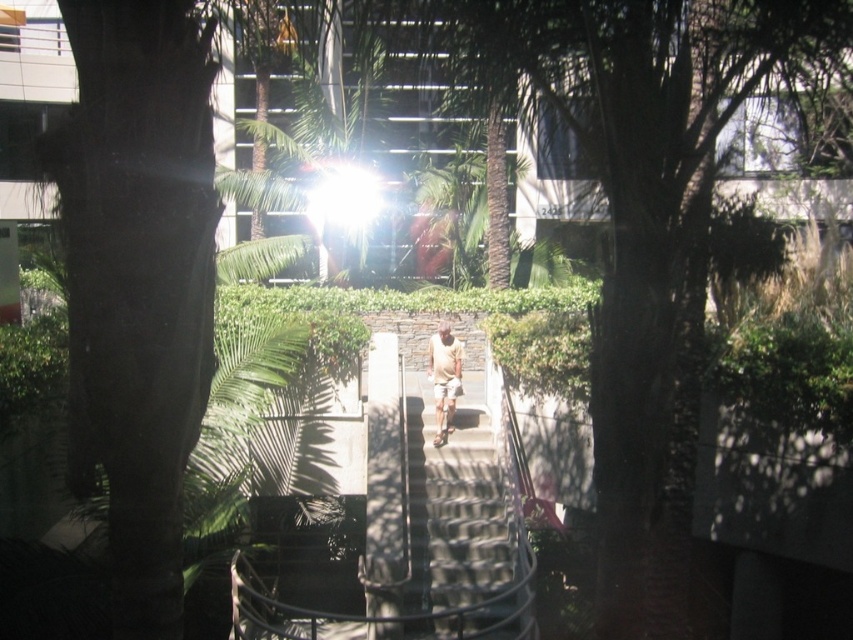
Between smooth concrete stairs at center and light brown shorts at center, which one is positioned lower?

Positioned lower is smooth concrete stairs at center.

Where is `smooth concrete stairs at center`? This screenshot has height=640, width=853. smooth concrete stairs at center is located at coordinates tap(463, 538).

Is point (415, 625) more distant than point (454, 381)?

No, (415, 625) is in front of (454, 381).

Find the location of a particular element. Image resolution: width=853 pixels, height=640 pixels. smooth concrete stairs at center is located at coordinates (463, 538).